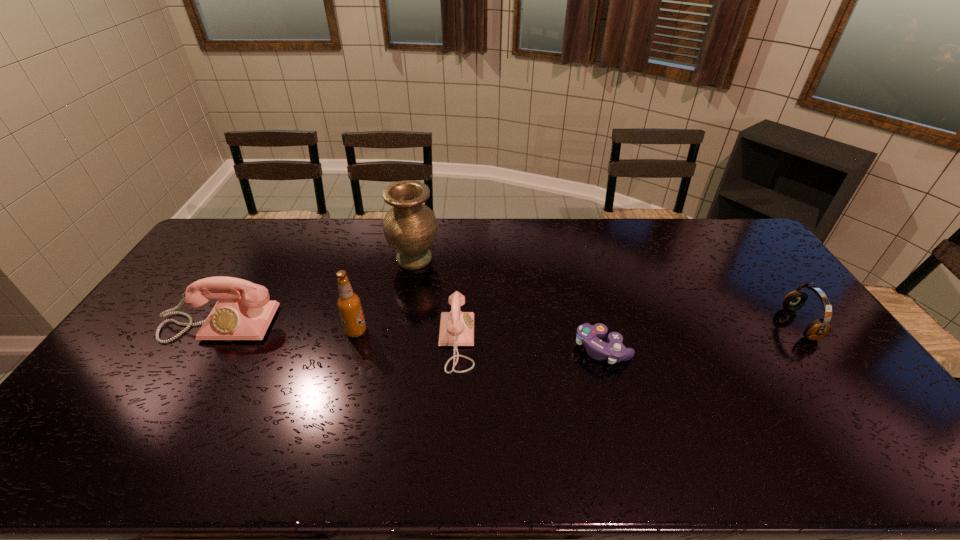
Identify the location of vacant space in between the rightmost object and the beer bottle. (578, 327).

Identify the location of vacant space in between the beer bottle and the tallest object. (385, 295).

Locate an element on the screen. Image resolution: width=960 pixels, height=540 pixels. free space that is in between the fourth shortest object and the headset is located at coordinates (510, 324).

Identify the location of free point between the right telephone and the leftmost object. (338, 333).

At what (x,y) coordinates should I click in order to perform the action: click on vacant space that is in between the left telephone and the shorter telephone. Please return your answer as a coordinate pair (x, y). Looking at the image, I should click on (338, 333).

At what (x,y) coordinates should I click in order to perform the action: click on free space that is in between the fifth object from left to right and the second object from left to right. Please return your answer as a coordinate pair (x, y). This screenshot has width=960, height=540. Looking at the image, I should click on (479, 340).

The width and height of the screenshot is (960, 540). Find the location of `empty location between the shorter telephone and the fourth shortest object`. empty location between the shorter telephone and the fourth shortest object is located at coordinates tap(338, 333).

The image size is (960, 540). I want to click on object that is the fourth closest to the vase, so click(588, 335).

Locate an element on the screen. object identified as the second closest to the headset is located at coordinates (456, 327).

Locate an element on the screen. The width and height of the screenshot is (960, 540). free location that satisfies the following two spatial constraints: 1. on the front label of the second object from left to right; 2. on the right side of the control is located at coordinates (351, 348).